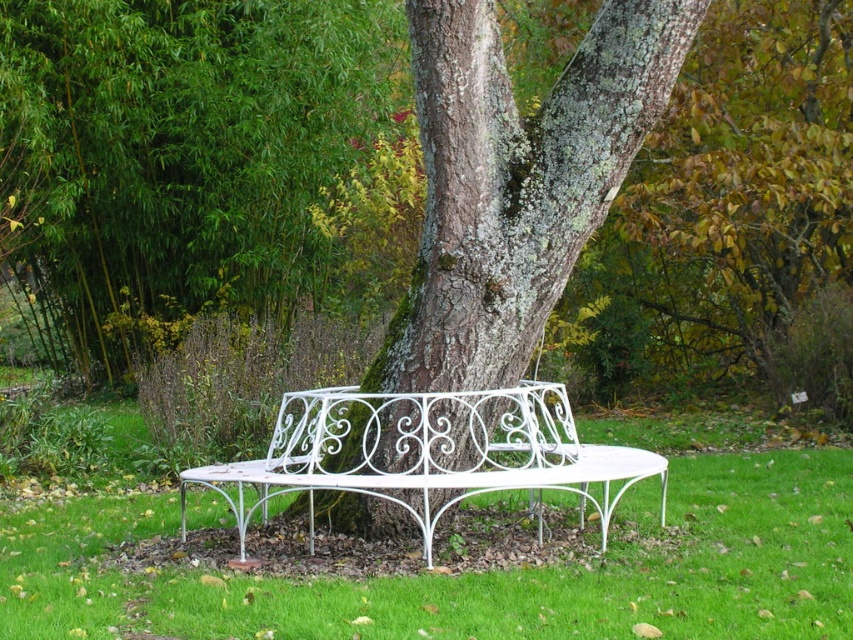
Is point (341, 104) farther from viewer compared to point (405, 387)?

Yes.

Does point (265, 230) come closer to viewer compared to point (508, 372)?

No, (265, 230) is behind (508, 372).

This screenshot has width=853, height=640. Describe the element at coordinates (184, 147) in the screenshot. I see `green bamboo at left` at that location.

The width and height of the screenshot is (853, 640). In order to click on green bamboo at left in this screenshot , I will do `click(184, 147)`.

Does green mossy bark at center appear on the left side of white wrought iron bench at center?

Incorrect, green mossy bark at center is not on the left side of white wrought iron bench at center.

Can you confirm if green mossy bark at center is positioned to the right of white wrought iron bench at center?

Yes, green mossy bark at center is to the right of white wrought iron bench at center.

Between point (479, 45) and point (389, 452), which one is positioned behind?

The point (389, 452) is more distant.

Locate an element on the screen. This screenshot has width=853, height=640. green mossy bark at center is located at coordinates (515, 180).

Which is more to the right, green bamboo at left or white wrought iron bench at center?

white wrought iron bench at center is more to the right.

Can you confirm if green bamboo at left is wider than white wrought iron bench at center?

Yes.

Between point (108, 364) and point (584, 476), which one is positioned in front?

Point (584, 476) is more forward.

I want to click on green bamboo at left, so click(184, 147).